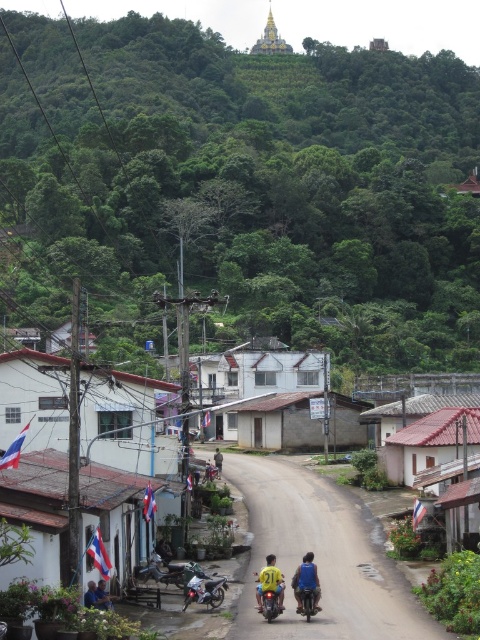
Question: Which object appears closest to the camera in this image?

Choices:
 (A) metallic silver motorcycle at center
 (B) yellow fabric shirt at center
 (C) yellow shirt at center
 (D) yellow matte motorcycle at center

Answer: (D)

Question: Does yellow fabric shirt at center have a greater width compared to dark blue shirt at center?

Choices:
 (A) yes
 (B) no

Answer: (A)

Question: Does metallic silver motorcycle at center lie behind blue shirt at lower left?

Choices:
 (A) no
 (B) yes

Answer: (B)

Question: Which point is closer to the camera?

Choices:
 (A) blue shirt at lower left
 (B) yellow fabric shirt at center
 (C) dark blue shirt at center
 (D) yellow shirt at center

Answer: (A)

Question: Among these objects, which one is farthest from the camera?

Choices:
 (A) yellow matte motorcycle at center
 (B) blue shirt at lower left
 (C) yellow shirt at center
 (D) silver metallic motorcycle at center

Answer: (C)

Question: Is yellow matte motorcycle at center below metallic silver motorcycle at center?

Choices:
 (A) yes
 (B) no

Answer: (B)